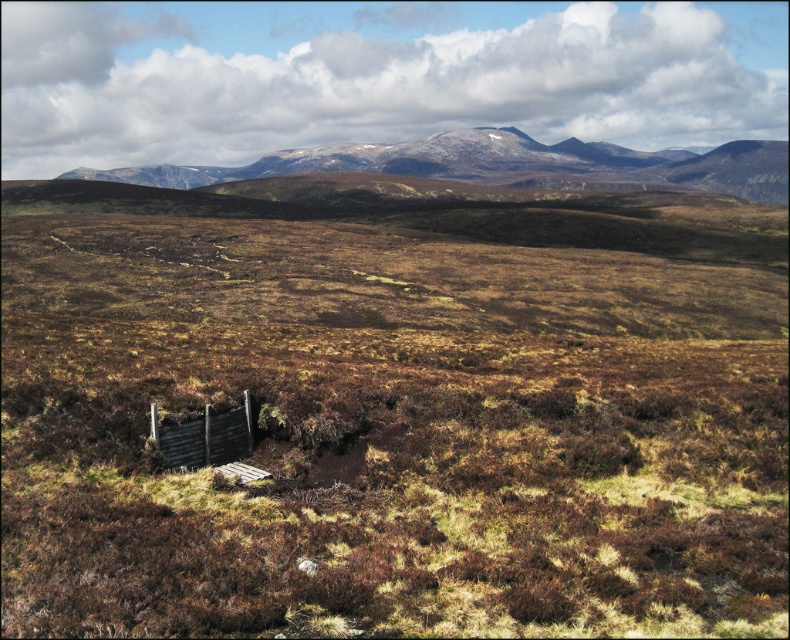
Question: Is rugged brown mountain at upper center thinner than wooden fence at lower center?

Choices:
 (A) no
 (B) yes

Answer: (A)

Question: Does rugged brown mountain at upper center appear on the right side of wooden fence at lower center?

Choices:
 (A) no
 (B) yes

Answer: (B)

Question: Is rugged brown mountain at upper center to the right of wooden fence at lower center from the viewer's perspective?

Choices:
 (A) no
 (B) yes

Answer: (B)

Question: Among these objects, which one is farthest from the camera?

Choices:
 (A) rugged brown mountain at upper center
 (B) wooden fence at lower center

Answer: (A)

Question: Among these points, which one is farthest from the camera?

Choices:
 (A) (224, 458)
 (B) (514, 132)

Answer: (B)